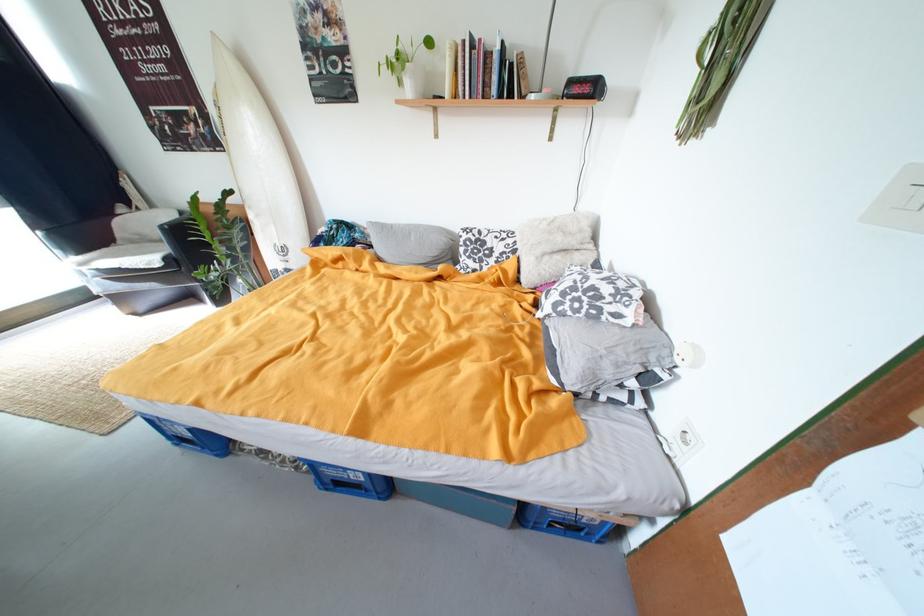
Find the location of `white plant pot`. white plant pot is located at coordinates (407, 65).